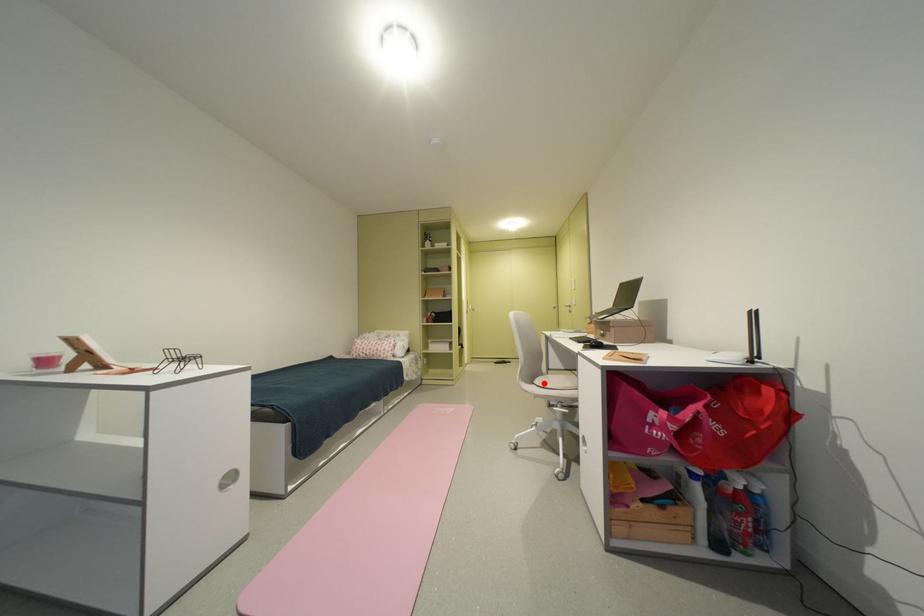
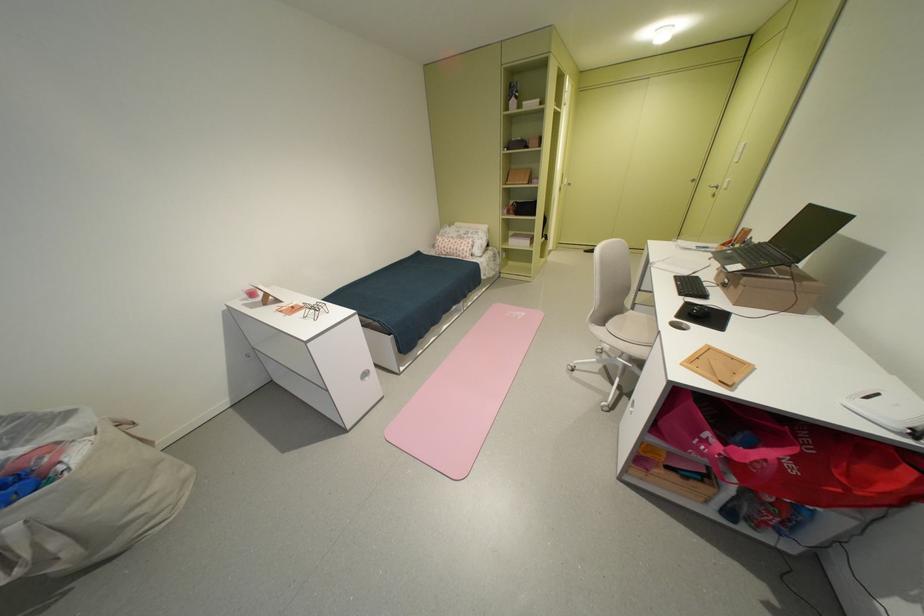
Where in the second image is the point corresponding to the highlighted location from the first image?

(615, 326)